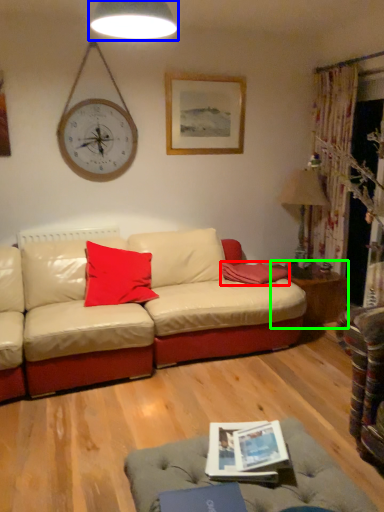
Question: Based on their relative distances, which object is farther from pillow (highlighted by a red box)? Choose from lamp (highlighted by a blue box) and table (highlighted by a green box).

Choices:
 (A) lamp
 (B) table

Answer: (A)